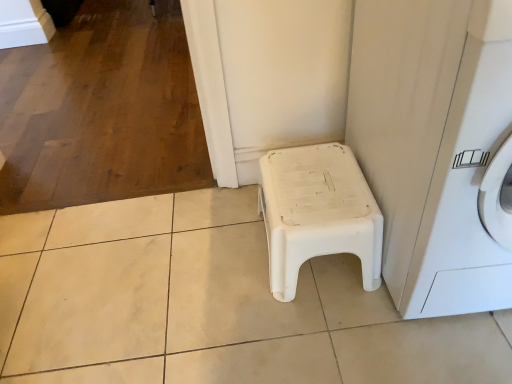
Locate an element on the screen. Image resolution: width=512 pixels, height=384 pixels. vacant area on top of white plastic stool at center (from a real-world perspective) is located at coordinates (315, 186).